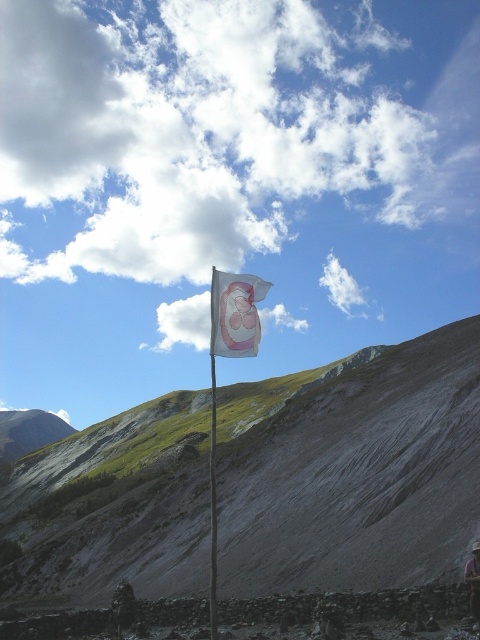
Question: Considering the real-world distances, which object is farthest from the pink fabric flag at center?

Choices:
 (A) white fabric flag at center
 (B) smooth gray rock at center
 (C) brown leather jacket at lower right

Answer: (A)

Question: Does white fabric flag at center have a smaller size compared to brown leather jacket at lower right?

Choices:
 (A) yes
 (B) no

Answer: (B)

Question: Does white fabric flag at center have a lesser width compared to brown leather jacket at lower right?

Choices:
 (A) no
 (B) yes

Answer: (A)

Question: Which object is farther from the camera taking this photo?

Choices:
 (A) smooth gray rock at center
 (B) brown leather jacket at lower right

Answer: (A)

Question: Is smooth gray rock at center in front of pink fabric flag at center?

Choices:
 (A) no
 (B) yes

Answer: (A)

Question: Which of the following is the closest to the observer?

Choices:
 (A) (216, 330)
 (B) (214, 563)
 (C) (475, 481)
 (D) (475, 570)

Answer: (A)